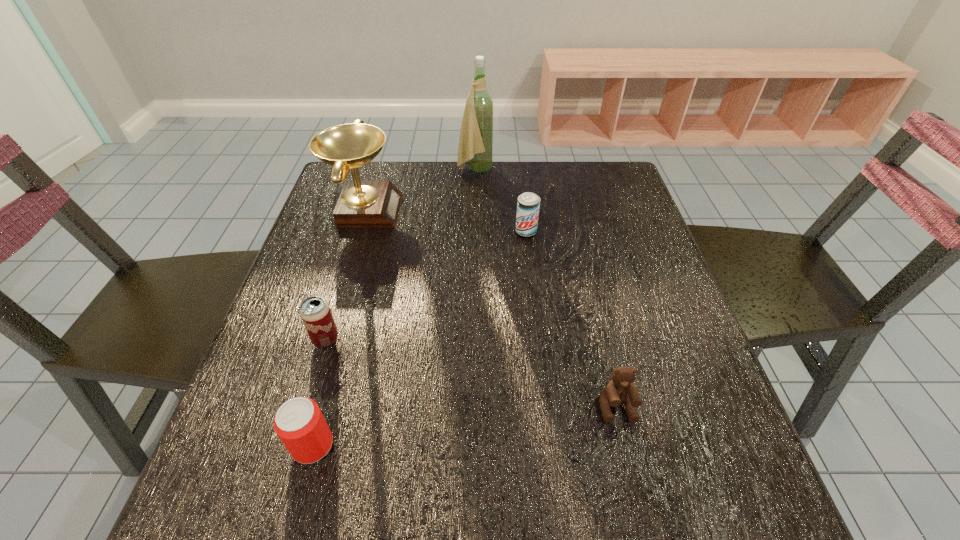
Identify the location of vacant position located on the front-facing side of the award. (542, 210).

Locate an element on the screen. free space located 0.200m on the back of the rightmost beer can is located at coordinates (520, 183).

Locate an element on the screen. The image size is (960, 540). vacant region located 0.090m on the back of the nearest object is located at coordinates pyautogui.click(x=330, y=380).

This screenshot has height=540, width=960. Find the location of `vacant space situated 0.220m on the back of the second nearest beer can`. vacant space situated 0.220m on the back of the second nearest beer can is located at coordinates (351, 256).

The image size is (960, 540). In order to click on free region located 0.070m on the face of the second nearest object in this screenshot , I will do `click(630, 464)`.

At what (x,y) coordinates should I click in order to perform the action: click on wine bottle that is positioned at the far edge. Please return your answer as a coordinate pair (x, y). The width and height of the screenshot is (960, 540). Looking at the image, I should click on (475, 147).

Where is `award situated at the far edge`? award situated at the far edge is located at coordinates (362, 203).

The image size is (960, 540). Find the location of `award located at the left edge`. award located at the left edge is located at coordinates (362, 203).

At what (x,y) coordinates should I click in order to perform the action: click on object located at the right edge. Please return your answer as a coordinate pair (x, y). This screenshot has width=960, height=540. Looking at the image, I should click on (620, 389).

Where is `object situated at the far left corner`? The height and width of the screenshot is (540, 960). object situated at the far left corner is located at coordinates (362, 203).